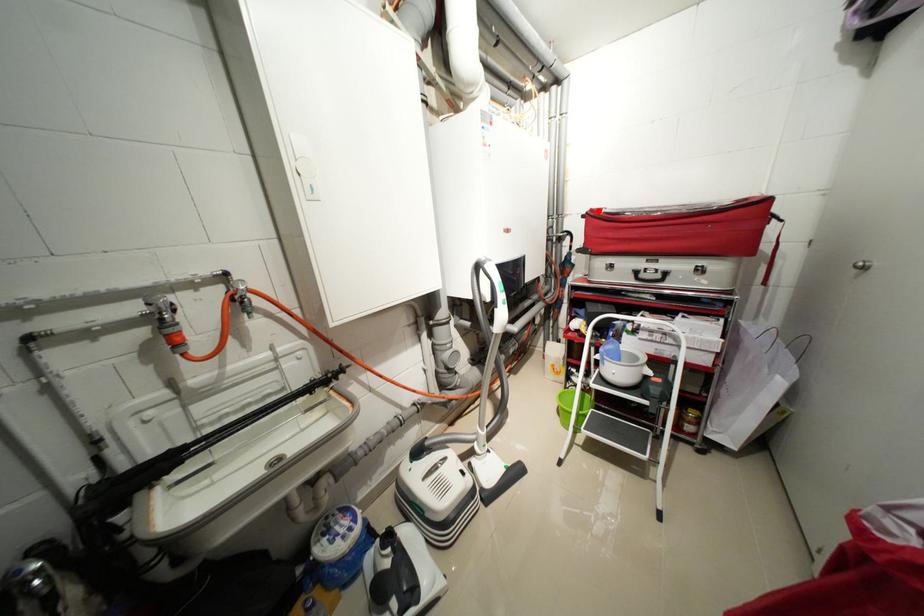
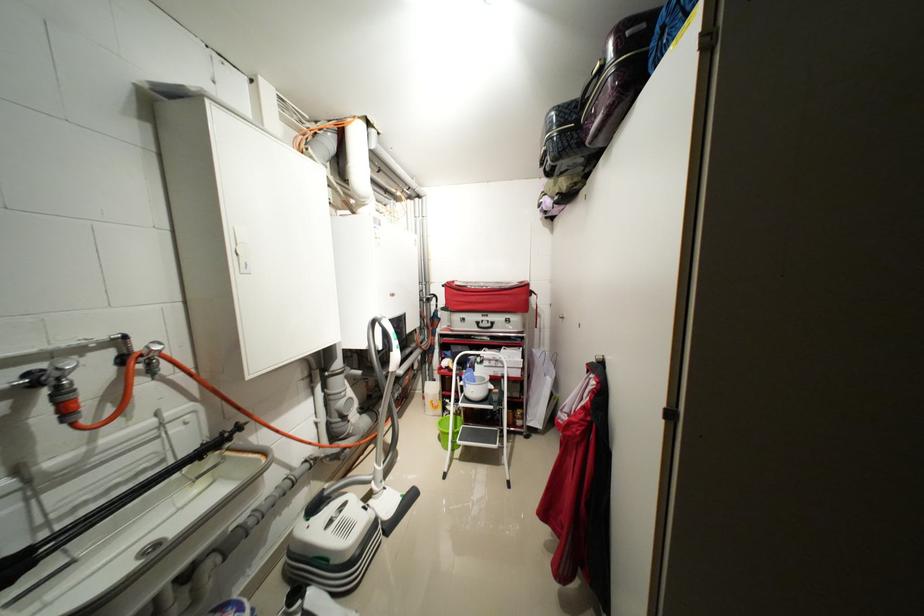
Where in the second image is the point corresponding to the highlighted location from the first image?

(455, 284)